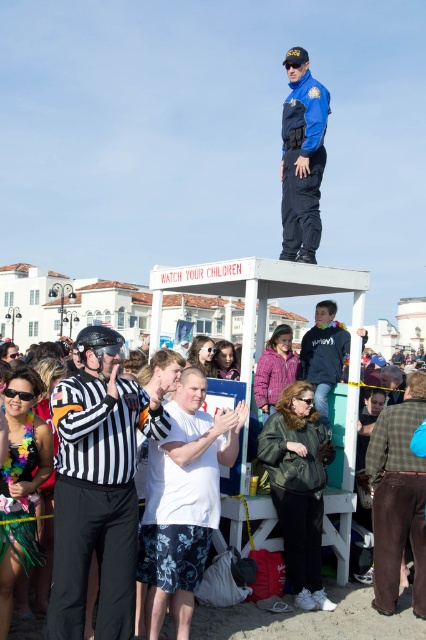
Question: Which of these objects is positioned farthest from the white cotton crowd at center?

Choices:
 (A) white floral shorts at center
 (B) black striped shirt at center

Answer: (B)

Question: Which point appears farthest from the camera in this image?

Choices:
 (A) (422, 420)
 (B) (288, 122)

Answer: (B)

Question: Is black striped shirt at center wider than green plaid shirt at lower right?

Choices:
 (A) no
 (B) yes

Answer: (B)

Question: Which point is farther to the camera?

Choices:
 (A) blue uniform at upper center
 (B) white floral shorts at center
 (C) green plaid shirt at lower right

Answer: (A)

Question: Can you confirm if white floral shorts at center is bigger than blue uniform at upper center?

Choices:
 (A) yes
 (B) no

Answer: (B)

Question: Does white floral shorts at center appear on the right side of blue uniform at upper center?

Choices:
 (A) no
 (B) yes

Answer: (A)